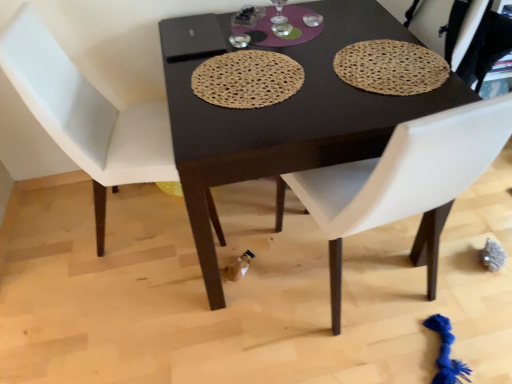
Where is `free space in front of white leather chair at left, arranged as the 1th chair when viewed from the left`? free space in front of white leather chair at left, arranged as the 1th chair when viewed from the left is located at coordinates (135, 309).